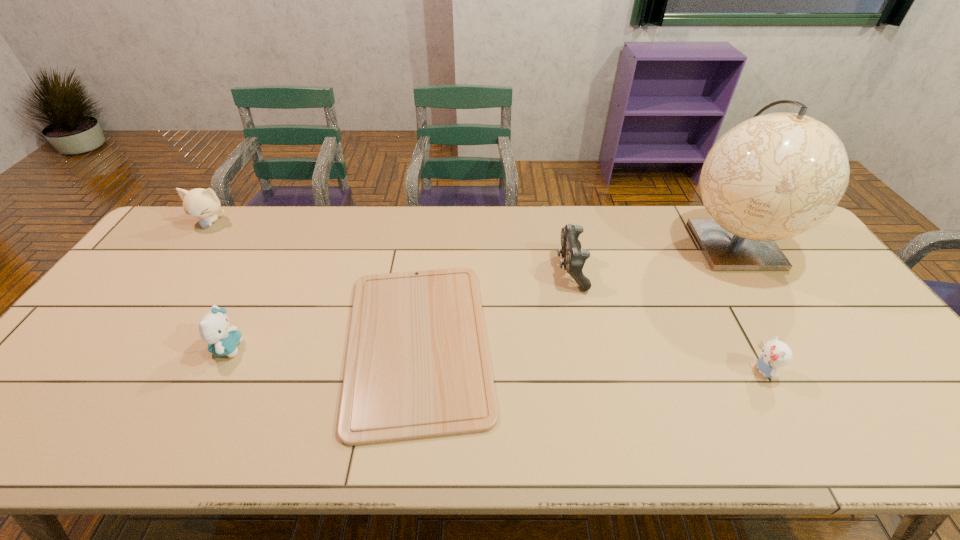
The width and height of the screenshot is (960, 540). In order to click on vacant area that lies between the fifth object from right to left and the farthest kitten in this screenshot , I will do `click(219, 285)`.

You are a GUI agent. You are given a task and a screenshot of the screen. Output one action in this format:
    pyautogui.click(x=<x>, y=<y>)
    Task: Click on the closest object to the globe
    Image resolution: width=960 pixels, height=540 pixels.
    Given the screenshot: What is the action you would take?
    pyautogui.click(x=775, y=353)

The height and width of the screenshot is (540, 960). In order to click on the closest object to the second object from left to right in this screenshot , I will do `click(417, 366)`.

The image size is (960, 540). Find the location of `kitten that is the second closest to the globe`. kitten that is the second closest to the globe is located at coordinates (214, 329).

This screenshot has width=960, height=540. Find the location of `kitten object that ranks as the second closest to the second kitten from right to left`. kitten object that ranks as the second closest to the second kitten from right to left is located at coordinates (775, 353).

Where is `free region that satisfies the following two spatial constraints: 1. on the surface of the tallest object showing Europe and Africa; 2. on the surface of the control with buttons`? The image size is (960, 540). free region that satisfies the following two spatial constraints: 1. on the surface of the tallest object showing Europe and Africa; 2. on the surface of the control with buttons is located at coordinates (750, 269).